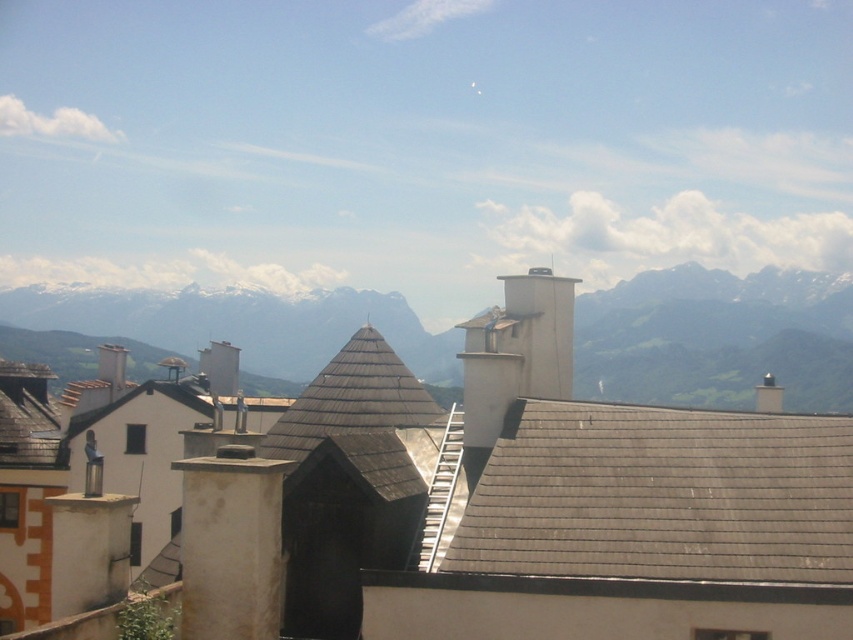
Is green grassy mountain range at upper center taller than brown shingles at center?

Yes.

Which of these two, green grassy mountain range at upper center or brown shingles at center, stands shorter?

brown shingles at center is shorter.

Between point (669, 288) and point (321, 404), which one is positioned behind?

Positioned behind is point (669, 288).

Find the location of a particular element. Image resolution: width=853 pixels, height=640 pixels. green grassy mountain range at upper center is located at coordinates (717, 337).

Is gray shingles at upper right shorter than green grassy mountain range at upper center?

Correct, gray shingles at upper right is not as tall as green grassy mountain range at upper center.

Is gray shingles at upper right below green grassy mountain range at upper center?

Yes, gray shingles at upper right is below green grassy mountain range at upper center.

Is point (837, 486) more distant than point (685, 355)?

No, it is not.

I want to click on gray shingles at upper right, so click(660, 496).

Who is more forward, (844, 556) or (386, 340)?

Positioned in front is point (844, 556).

Image resolution: width=853 pixels, height=640 pixels. I want to click on gray shingles at upper right, so click(x=660, y=496).

At what (x,y) coordinates should I click in order to perform the action: click on gray shingles at upper right. Please return your answer as a coordinate pair (x, y). This screenshot has height=640, width=853. Looking at the image, I should click on click(660, 496).